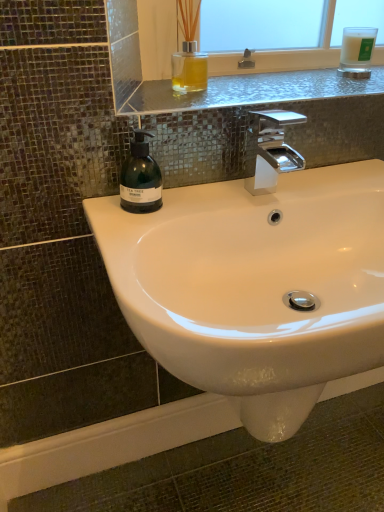
Locate an element on the screen. This screenshot has width=384, height=512. free location to the right of polished chrome faucet at center is located at coordinates (329, 186).